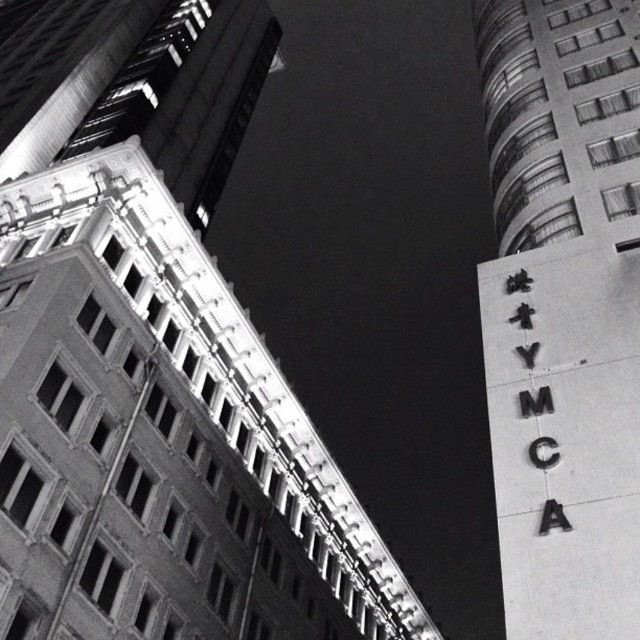
Question: Does metallic ymca sign at upper right appear on the left side of smooth concrete building at left?

Choices:
 (A) no
 (B) yes

Answer: (A)

Question: Does metallic ymca sign at upper right have a greater width compared to smooth concrete building at left?

Choices:
 (A) no
 (B) yes

Answer: (A)

Question: Which point appears closest to the camera in this image?

Choices:
 (A) (x=230, y=32)
 (B) (x=499, y=273)

Answer: (B)

Question: Among these objects, which one is nearest to the camera?

Choices:
 (A) metallic ymca sign at upper right
 (B) smooth concrete building at left

Answer: (A)

Question: Which point is farther to the camera?

Choices:
 (A) 38,61
 (B) 570,321

Answer: (A)

Question: Can you confirm if metallic ymca sign at upper right is thinner than smooth concrete building at left?

Choices:
 (A) no
 (B) yes

Answer: (B)